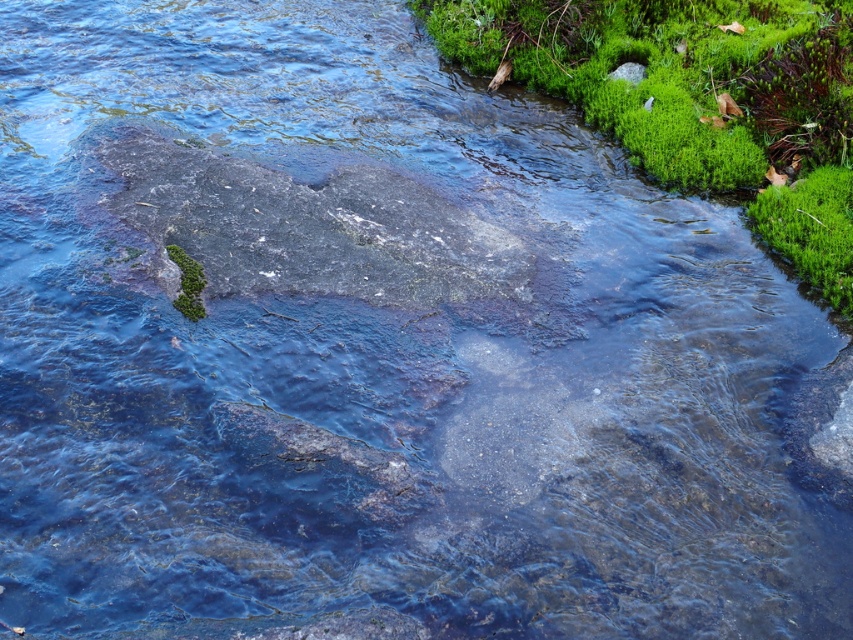
Question: Which of the following is the farthest from the observer?

Choices:
 (A) green mossy algae at upper right
 (B) green mossy rock at lower left

Answer: (A)

Question: Can you confirm if green mossy algae at upper right is thinner than green mossy rock at lower left?

Choices:
 (A) yes
 (B) no

Answer: (B)

Question: Which of the following is the farthest from the observer?

Choices:
 (A) green mossy algae at upper right
 (B) green mossy rock at lower left

Answer: (A)

Question: Considering the relative positions of green mossy algae at upper right and green mossy rock at lower left in the image provided, where is green mossy algae at upper right located with respect to green mossy rock at lower left?

Choices:
 (A) left
 (B) right

Answer: (B)

Question: Does green mossy algae at upper right have a greater width compared to green mossy rock at lower left?

Choices:
 (A) no
 (B) yes

Answer: (B)

Question: Which point appears closest to the camera in this image?

Choices:
 (A) (795, 6)
 (B) (198, 292)

Answer: (B)